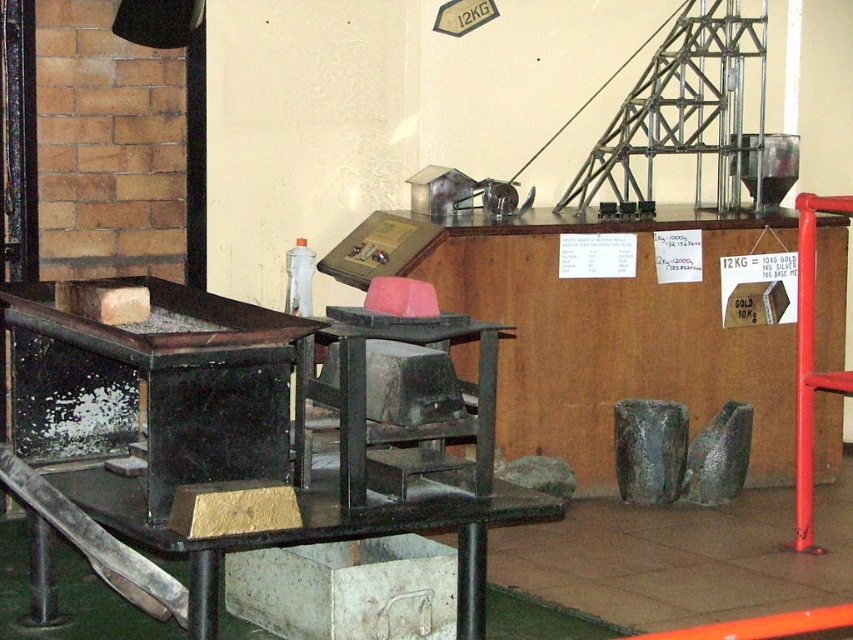
Question: Observing the image, what is the correct spatial positioning of black matte table at left in reference to metallic gray table at lower left?

Choices:
 (A) above
 (B) below

Answer: (A)

Question: Is metallic gray machine at center wider than metallic gray table at lower left?

Choices:
 (A) yes
 (B) no

Answer: (A)

Question: Which object is positioned closest to the metallic gray table at lower left?

Choices:
 (A) metallic gray machine at center
 (B) black matte table at left

Answer: (B)

Question: Is metallic gray machine at center further to camera compared to metallic gray table at lower left?

Choices:
 (A) yes
 (B) no

Answer: (A)

Question: Among these objects, which one is farthest from the camera?

Choices:
 (A) black matte table at left
 (B) metallic gray machine at center
 (C) metallic gray table at lower left

Answer: (B)

Question: Which object is the farthest from the metallic gray table at lower left?

Choices:
 (A) metallic gray machine at center
 (B) black matte table at left

Answer: (A)